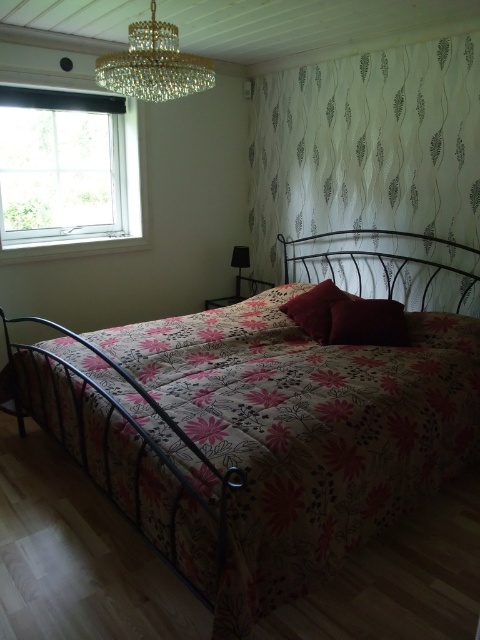
Who is taller, white textured curtain at upper center or velvet red pillow at center?

With more height is white textured curtain at upper center.

Is white textured curtain at upper center closer to the viewer compared to velvet red pillow at center?

Yes, white textured curtain at upper center is closer to the viewer.

The width and height of the screenshot is (480, 640). I want to click on white textured curtain at upper center, so click(x=372, y=172).

Where is `white textured curtain at upper center`? Image resolution: width=480 pixels, height=640 pixels. white textured curtain at upper center is located at coordinates (372, 172).

Is white plastic window at upper left further to camera compared to velvet red pillow at center?

Yes, it is.

Is white plastic window at upper left closer to camera compared to velvet red pillow at center?

That is False.

Does point (0, 248) come closer to viewer compared to point (288, 300)?

Yes.

Identify the location of white plastic window at upper left. The width and height of the screenshot is (480, 640). click(88, 225).

Between white textured curtain at upper center and black glass lamp at center, which one has less height?

black glass lamp at center

Is white textured curtain at upper center to the left of black glass lamp at center from the viewer's perspective?

No, white textured curtain at upper center is not to the left of black glass lamp at center.

Which is behind, point (418, 260) or point (241, 256)?

Point (241, 256)

This screenshot has height=640, width=480. Identify the location of white textured curtain at upper center. (372, 172).